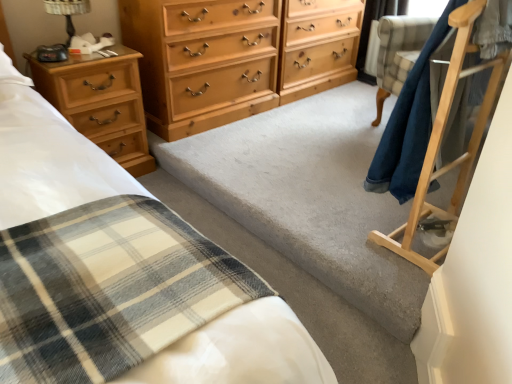
Question: Looking at their shapes, would you say metallic black table lamp at upper left is wider or thinner than light brown wood dresser at center?

Choices:
 (A) wide
 (B) thin

Answer: (B)

Question: Based on their sizes in the image, would you say metallic black table lamp at upper left is bigger or smaller than light brown wood dresser at center?

Choices:
 (A) small
 (B) big

Answer: (A)

Question: Estimate the real-world distances between objects in this image. Which object is farther from the light brown wood dresser at center?

Choices:
 (A) metallic black table lamp at upper left
 (B) light brown wood chest of drawers at center, marked as the 1th chest of drawers in a right-to-left arrangement
 (C) light brown wood chest of drawers at left, positioned as the second chest of drawers in right-to-left order

Answer: (A)

Question: Considering the real-world distances, which object is farthest from the light brown wood dresser at center?

Choices:
 (A) metallic black table lamp at upper left
 (B) light brown wood chest of drawers at center, the second chest of drawers viewed from the left
 (C) light brown wood chest of drawers at left, positioned as the second chest of drawers in right-to-left order

Answer: (A)